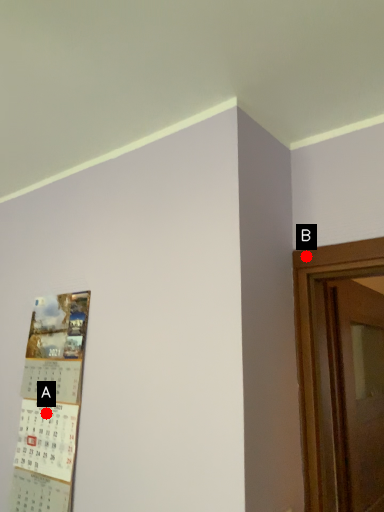
Question: Two points are circled on the image, labeled by A and B beside each circle. Which point appears closest to the camera in this image?

Choices:
 (A) A is closer
 (B) B is closer

Answer: (B)